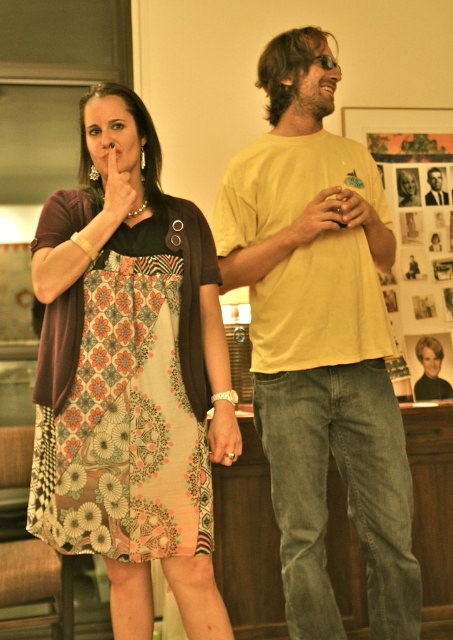
Is floral-patterned fabric dress at center closer to the viewer compared to smooth beige shirt at upper right?

Yes, floral-patterned fabric dress at center is in front of smooth beige shirt at upper right.

Is floral-patterned fabric dress at center to the right of smooth beige shirt at upper right from the viewer's perspective?

Incorrect, floral-patterned fabric dress at center is not on the right side of smooth beige shirt at upper right.

Which is behind, point (94, 376) or point (437, 186)?

Positioned behind is point (437, 186).

You are a GUI agent. You are given a task and a screenshot of the screen. Output one action in this format:
    pyautogui.click(x=<x>, y=<y>)
    Task: Click on the floral-patterned fabric dress at center
    
    Given the screenshot: What is the action you would take?
    pyautogui.click(x=126, y=403)

Is yellow cotton t-shirt at center positioned behind floral-patterned fabric dress at center?

Yes.

Which is in front, point (384, 483) or point (192, 371)?

Point (192, 371)

Locate an element on the screen. The image size is (453, 640). yellow cotton t-shirt at center is located at coordinates (321, 339).

Does yellow cotton t-shirt at center have a lesser height compared to smooth beige shirt at upper right?

No, yellow cotton t-shirt at center is not shorter than smooth beige shirt at upper right.

Which is above, yellow cotton t-shirt at center or smooth beige shirt at upper right?

smooth beige shirt at upper right is higher up.

Identify the location of yellow cotton t-shirt at center. Image resolution: width=453 pixels, height=640 pixels. (321, 339).

Where is `yellow cotton t-shirt at center`? Image resolution: width=453 pixels, height=640 pixels. yellow cotton t-shirt at center is located at coordinates (321, 339).